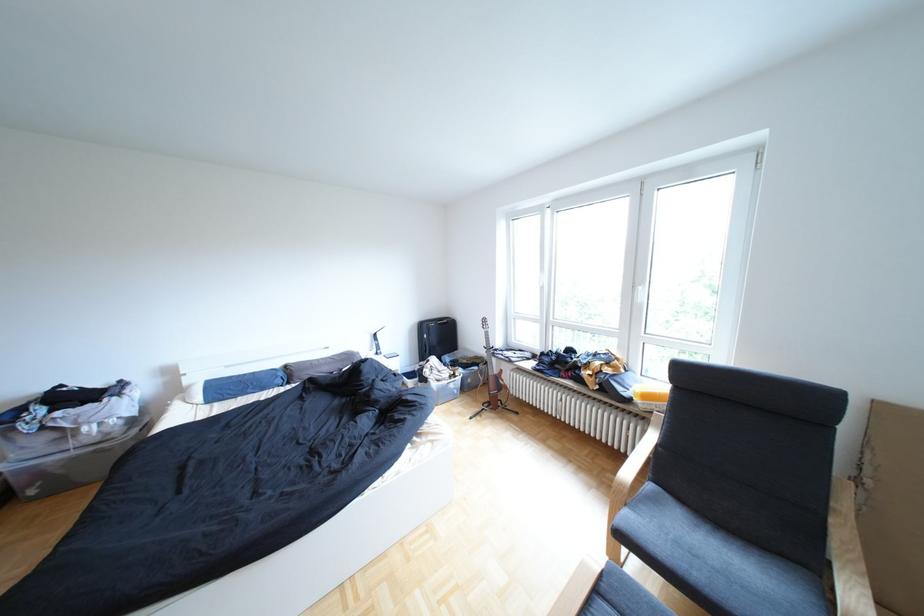
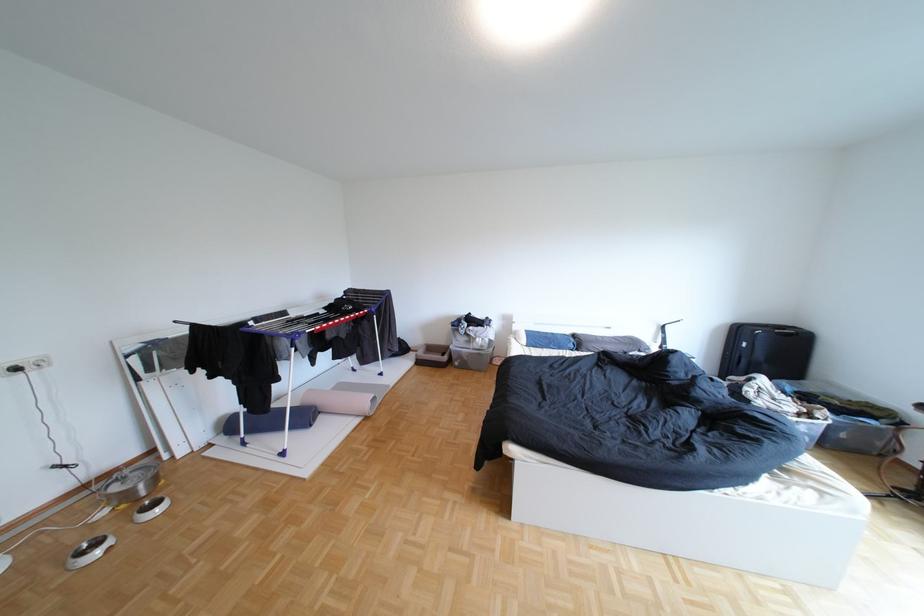
Locate, in the second image, the point that corresponds to point (301, 367) in the first image.

(590, 336)